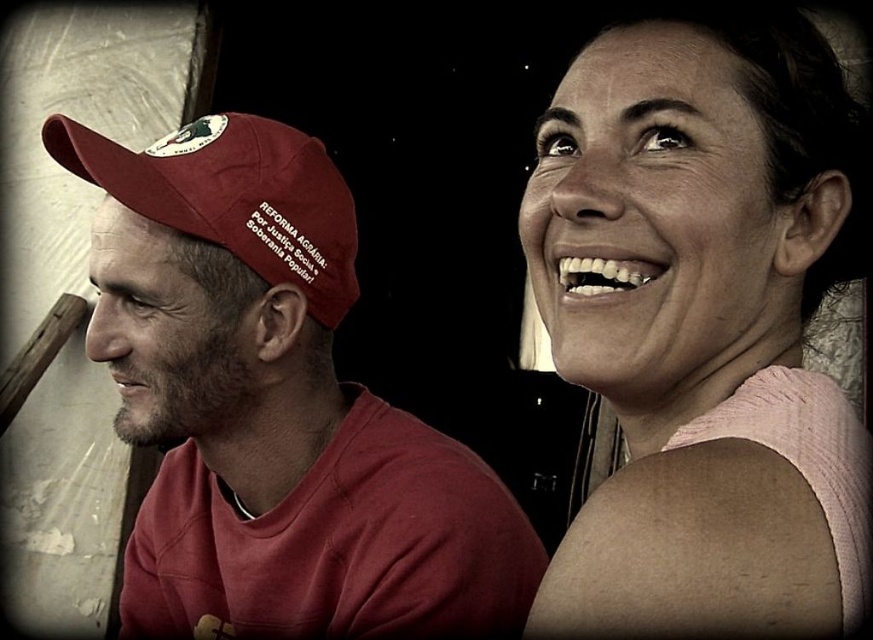
Does pink fabric at upper right lie in front of maroon fabric cap at left?

Yes, pink fabric at upper right is in front of maroon fabric cap at left.

Can you confirm if pink fabric at upper right is wider than maroon fabric cap at left?

No, pink fabric at upper right is not wider than maroon fabric cap at left.

Does point (620, 60) come behind point (251, 148)?

No, it is in front of (251, 148).

Where is `pink fabric at upper right`? The height and width of the screenshot is (640, 873). pink fabric at upper right is located at coordinates pyautogui.click(x=689, y=316).

Can you confirm if matte red cap at left is thinner than maroon fabric cap at left?

No, matte red cap at left is not thinner than maroon fabric cap at left.

Does point (314, 177) lie behind point (194, 122)?

No, (314, 177) is in front of (194, 122).

Is point (148, 371) behind point (210, 134)?

No, it is not.

This screenshot has width=873, height=640. Find the location of `matte red cap at left`. matte red cap at left is located at coordinates (273, 406).

Which is in front, point (802, 243) or point (346, 500)?

Point (802, 243) is more forward.

The width and height of the screenshot is (873, 640). What do you see at coordinates (689, 316) in the screenshot?
I see `pink fabric at upper right` at bounding box center [689, 316].

Where is `pink fabric at upper right`? The image size is (873, 640). pink fabric at upper right is located at coordinates 689,316.